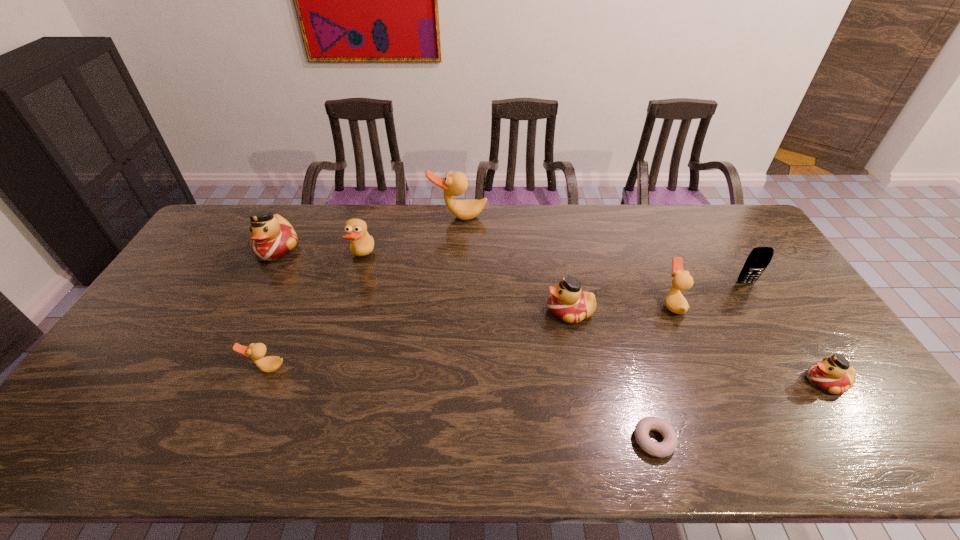
At what (x,y) coordinates should I click in order to perform the action: click on the rightmost tan duck. Please return your answer as a coordinate pair (x, y). The image size is (960, 540). Looking at the image, I should click on (682, 280).

You are a GUI agent. You are given a task and a screenshot of the screen. Output one action in this format:
    pyautogui.click(x=<x>, y=<y>)
    Task: Click on the rightmost red duck
    The width and height of the screenshot is (960, 540).
    Given the screenshot: What is the action you would take?
    pyautogui.click(x=833, y=374)

Identify the location of the rightmost duck. The image size is (960, 540). (833, 374).

What are the coordinates of `the smallest tan duck` in the screenshot? It's located at (268, 364).

You are a GUI agent. You are given a task and a screenshot of the screen. Output one action in this format:
    pyautogui.click(x=<x>, y=<y>)
    Task: Click on the second duck from left to right
    The width and height of the screenshot is (960, 540).
    Given the screenshot: What is the action you would take?
    pyautogui.click(x=268, y=364)

Locate an element on the screen. This screenshot has width=960, height=540. the fourth object from right to left is located at coordinates (669, 444).

I want to click on the nearest object, so click(669, 444).

Identify the location of vacant area situated 0.370m on the beak of the second tan duck from right to left. The height and width of the screenshot is (540, 960). (454, 297).

The height and width of the screenshot is (540, 960). What are the coordinates of `free space located 0.070m on the face of the biggest red duck` in the screenshot? It's located at (260, 280).

You are a GUI agent. You are given a task and a screenshot of the screen. Output one action in this format:
    pyautogui.click(x=<x>, y=<y>)
    Task: Click on the free space located 0.390m on the beak of the fifth duck from right to left
    The width and height of the screenshot is (960, 540).
    Given the screenshot: What is the action you would take?
    pyautogui.click(x=489, y=257)